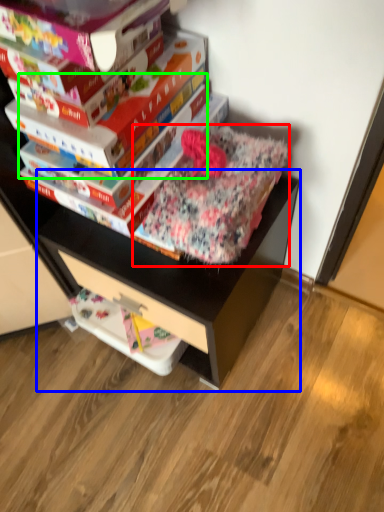
Question: Which is farther away from bedding (highlighted by a red box)? computer desk (highlighted by a blue box) or paperback book (highlighted by a green box)?

Choices:
 (A) computer desk
 (B) paperback book

Answer: (A)